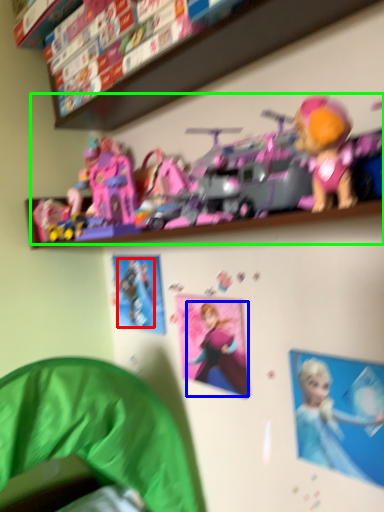
Question: Which object is positioned farthest from person (highlighted by a red box)? Select from toy (highlighted by a blue box) and toy (highlighted by a green box).

Choices:
 (A) toy
 (B) toy

Answer: (B)